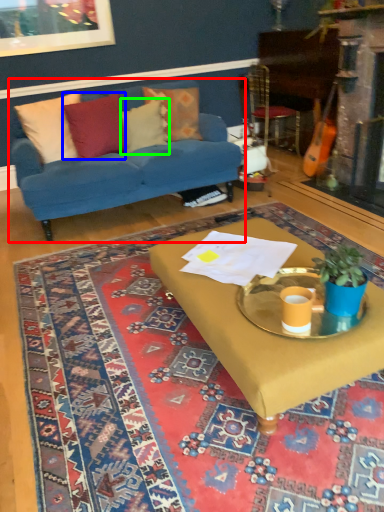
Question: Considering the real-world distances, which object is farthest from studio couch (highlighted by a red box)? pillow (highlighted by a blue box) or pillow (highlighted by a green box)?

Choices:
 (A) pillow
 (B) pillow

Answer: (B)